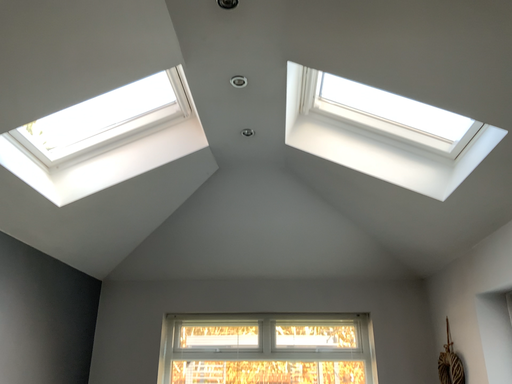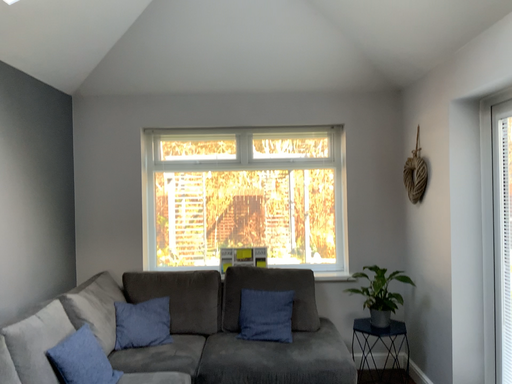
Question: Which way did the camera rotate in the video?

Choices:
 (A) rotated downward
 (B) rotated upward

Answer: (A)